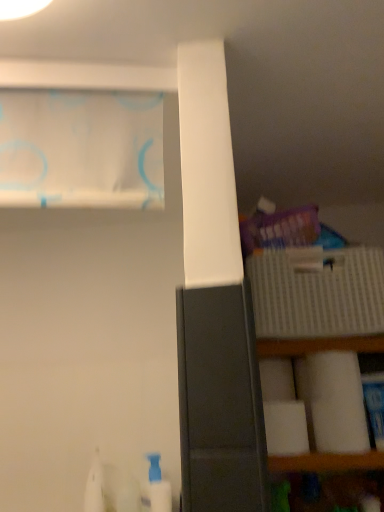
Measure the distance between white matte toilet paper at lower right, the first toilet paper from the back, and camera.

The depth of white matte toilet paper at lower right, the first toilet paper from the back, is 95.50 centimeters.

Measure the distance between point [56,176] and camera.

Point [56,176] and camera are 26.77 inches apart from each other.

Find the location of a particular element. The height and width of the screenshot is (512, 384). white plastic bottle at lower left is located at coordinates (158, 486).

Is white matte toilet paper at lower right, which ranks as the 2th toilet paper in front-to-back order, looking in the opposite direction of white matte toilet paper at right, which is counted as the 2th toilet paper, starting from the back?

white matte toilet paper at lower right, which ranks as the 2th toilet paper in front-to-back order, does not have its back to white matte toilet paper at right, which is counted as the 2th toilet paper, starting from the back.

From the image's perspective, which is above, white matte toilet paper at lower right, which ranks as the 2th toilet paper in front-to-back order, or white matte toilet paper at right, which is counted as the 2th toilet paper, starting from the back?

white matte toilet paper at lower right, which ranks as the 2th toilet paper in front-to-back order, from the image's perspective.

Which of these two, white matte toilet paper at lower right, the first toilet paper from the back, or white matte toilet paper at right, which is the 1th toilet paper in front-to-back order, is bigger?

white matte toilet paper at right, which is the 1th toilet paper in front-to-back order, is bigger.

Locate an element on the screen. This screenshot has width=384, height=512. toilet paper that appears behind the white matte toilet paper at right, which is counted as the 2th toilet paper, starting from the back is located at coordinates (277, 380).

Identify the location of cleaning product on the right of white sheer curtain at upper left. Image resolution: width=384 pixels, height=512 pixels. (158, 486).

From the image's perspective, which one is positioned lower, white sheer curtain at upper left or white plastic bottle at lower left?

white plastic bottle at lower left appears lower in the image.

Is white sheer curtain at upper left facing away from white plastic bottle at lower left?

No, white sheer curtain at upper left is not facing the opposite direction of white plastic bottle at lower left.

Is white sheer curtain at upper left spatially inside white plastic bottle at lower left, or outside of it?

white sheer curtain at upper left cannot be found inside white plastic bottle at lower left.

Considering the relative positions of white sheer curtain at upper left and white matte toilet paper at lower right, which ranks as the 2th toilet paper in front-to-back order, in the image provided, is white sheer curtain at upper left to the left of white matte toilet paper at lower right, which ranks as the 2th toilet paper in front-to-back order, from the viewer's perspective?

Indeed, white sheer curtain at upper left is positioned on the left side of white matte toilet paper at lower right, which ranks as the 2th toilet paper in front-to-back order.

Locate an element on the screen. The width and height of the screenshot is (384, 512). curtain to the left of white matte toilet paper at lower right, which ranks as the 2th toilet paper in front-to-back order is located at coordinates (81, 149).

From the picture: Is white sheer curtain at upper left taller or shorter than white matte toilet paper at lower right, which ranks as the 2th toilet paper in front-to-back order?

Considering their sizes, white sheer curtain at upper left has more height than white matte toilet paper at lower right, which ranks as the 2th toilet paper in front-to-back order.

Which of these two, white sheer curtain at upper left or white matte toilet paper at lower right, the first toilet paper from the back, is bigger?

white sheer curtain at upper left is bigger.

Is white matte toilet paper at right, which is counted as the 2th toilet paper, starting from the back, not near white sheer curtain at upper left?

No, white matte toilet paper at right, which is counted as the 2th toilet paper, starting from the back, is not far away from white sheer curtain at upper left.

From the image's perspective, which object appears higher, white matte toilet paper at right, which is counted as the 2th toilet paper, starting from the back, or white sheer curtain at upper left?

white sheer curtain at upper left, from the image's perspective.

Looking at their sizes, would you say white matte toilet paper at right, which is counted as the 2th toilet paper, starting from the back, is wider or thinner than white sheer curtain at upper left?

Clearly, white matte toilet paper at right, which is counted as the 2th toilet paper, starting from the back, has more width compared to white sheer curtain at upper left.

How distant is white matte toilet paper at right, which is counted as the 2th toilet paper, starting from the back, from white plastic bottle at lower left?

They are 17.17 inches apart.

From the image's perspective, is white matte toilet paper at right, which is the 1th toilet paper in front-to-back order, above white plastic bottle at lower left?

Yes.

Can you tell me how much white matte toilet paper at right, which is counted as the 2th toilet paper, starting from the back, and white plastic bottle at lower left differ in facing direction?

They differ by 0.00157 degrees in their facing directions.

Is white matte toilet paper at right, which is counted as the 2th toilet paper, starting from the back, positioned beyond the bounds of white plastic bottle at lower left?

white matte toilet paper at right, which is counted as the 2th toilet paper, starting from the back, lies outside white plastic bottle at lower left's area.

How different are the orientations of white plastic bottle at lower left and white matte toilet paper at lower right, the first toilet paper from the back, in degrees?

There is a 0.000712-degree angle between the facing directions of white plastic bottle at lower left and white matte toilet paper at lower right, the first toilet paper from the back.

In the scene shown: How distant is white plastic bottle at lower left from white matte toilet paper at lower right, the first toilet paper from the back?

white plastic bottle at lower left is 16.24 inches from white matte toilet paper at lower right, the first toilet paper from the back.

Which object is positioned more to the left, white plastic bottle at lower left or white matte toilet paper at lower right, the first toilet paper from the back?

white plastic bottle at lower left.

From the picture: Is white plastic bottle at lower left facing away from white matte toilet paper at lower right, the first toilet paper from the back?

white plastic bottle at lower left does not have its back to white matte toilet paper at lower right, the first toilet paper from the back.

Does white plastic bottle at lower left appear on the left side of white matte toilet paper at right, which is the 1th toilet paper in front-to-back order?

Yes.

Considering the points (161, 475) and (301, 437), which point is behind, point (161, 475) or point (301, 437)?

The point (161, 475) is more distant.

Is white plastic bottle at lower left positioned before white matte toilet paper at right, which is the 1th toilet paper in front-to-back order?

No, it is not.

Locate an element on the screen. toilet paper located on the left of white matte toilet paper at lower right, which ranks as the 2th toilet paper in front-to-back order is located at coordinates (286, 428).

Where is `cleaning product behind the white sheer curtain at upper left`? The height and width of the screenshot is (512, 384). cleaning product behind the white sheer curtain at upper left is located at coordinates (158, 486).

Estimate the real-world distances between objects in this image. Which object is further from white plastic bottle at lower left, white sheer curtain at upper left or white matte toilet paper at lower right, the first toilet paper from the back?

white sheer curtain at upper left is further to white plastic bottle at lower left.

From the image, which object appears to be nearer to white matte toilet paper at lower right, the first toilet paper from the back, white plastic bottle at lower left or white matte toilet paper at right, which is the 1th toilet paper in front-to-back order?

white matte toilet paper at right, which is the 1th toilet paper in front-to-back order, is closer to white matte toilet paper at lower right, the first toilet paper from the back.

Looking at the image, which one is located further to white matte toilet paper at lower right, which ranks as the 2th toilet paper in front-to-back order, white matte toilet paper at right, which is the 1th toilet paper in front-to-back order, or white sheer curtain at upper left?

The object further to white matte toilet paper at lower right, which ranks as the 2th toilet paper in front-to-back order, is white sheer curtain at upper left.

Which object lies further to the anchor point white sheer curtain at upper left, white matte toilet paper at lower right, which ranks as the 2th toilet paper in front-to-back order, or white plastic bottle at lower left?

Among the two, white plastic bottle at lower left is located further to white sheer curtain at upper left.

From the image, which object appears to be nearer to white sheer curtain at upper left, white matte toilet paper at lower right, the first toilet paper from the back, or white matte toilet paper at right, which is the 1th toilet paper in front-to-back order?

Among the two, white matte toilet paper at lower right, the first toilet paper from the back, is located nearer to white sheer curtain at upper left.

When comparing their distances from white sheer curtain at upper left, does white matte toilet paper at right, which is counted as the 2th toilet paper, starting from the back, or white matte toilet paper at lower right, the first toilet paper from the back, seem closer?

white matte toilet paper at lower right, the first toilet paper from the back, is closer to white sheer curtain at upper left.

In the scene shown: From the image, which object appears to be nearer to white matte toilet paper at right, which is counted as the 2th toilet paper, starting from the back, white sheer curtain at upper left or white matte toilet paper at lower right, the first toilet paper from the back?

The object closer to white matte toilet paper at right, which is counted as the 2th toilet paper, starting from the back, is white matte toilet paper at lower right, the first toilet paper from the back.

Which object lies further to the anchor point white matte toilet paper at lower right, the first toilet paper from the back, white plastic bottle at lower left or white sheer curtain at upper left?

The object further to white matte toilet paper at lower right, the first toilet paper from the back, is white sheer curtain at upper left.

You are a GUI agent. You are given a task and a screenshot of the screen. Output one action in this format:
    pyautogui.click(x=<x>, y=<y>)
    Task: Click on the toilet paper between white sheer curtain at upper left and white matte toilet paper at right, which is the 1th toilet paper in front-to-back order, vertically
    This screenshot has height=512, width=384.
    Given the screenshot: What is the action you would take?
    pyautogui.click(x=277, y=380)

Find the location of a particular element. This screenshot has height=512, width=384. toilet paper that lies between white matte toilet paper at lower right, the first toilet paper from the back, and white plastic bottle at lower left from top to bottom is located at coordinates (286, 428).